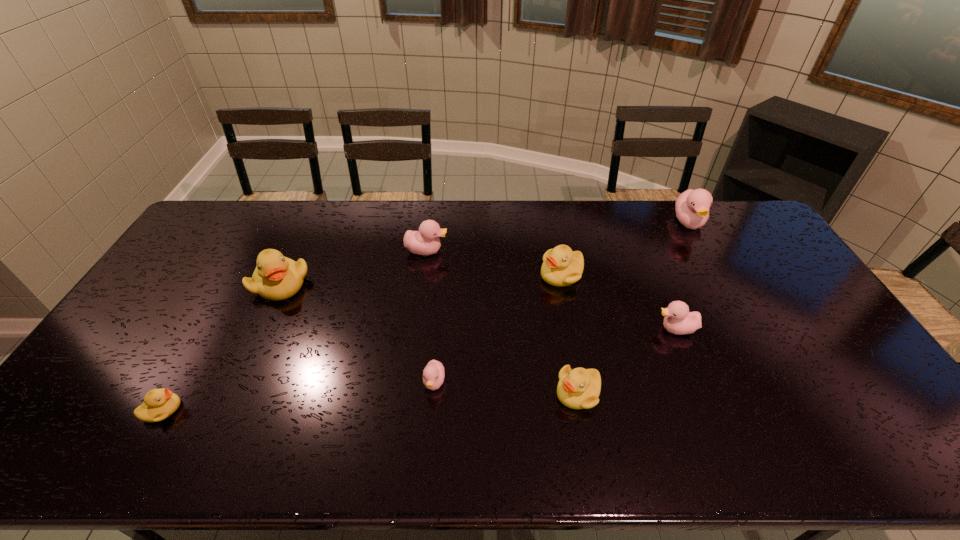
Identify which yellow duckling is the fourth closest to the second duckling from right to left. Please provide its 2D coordinates. Your answer should be formatted as a tuple, i.e. [(x, y)], where the tuple contains the x and y coordinates of a point satisfying the conditions above.

[(159, 404)]

Identify the location of free space that satisfies the following two spatial constraints: 1. on the front-facing side of the farthest object; 2. on the front-facing side of the smallest yellow duckling. The height and width of the screenshot is (540, 960). (794, 410).

Find the location of a particular element. This screenshot has height=540, width=960. vacant space that satisfies the following two spatial constraints: 1. on the front-facing side of the second biggest yellow duckling; 2. on the front-facing side of the seventh duckling from right to left is located at coordinates (564, 284).

The width and height of the screenshot is (960, 540). What are the coordinates of `blank space that satisfies the following two spatial constraints: 1. on the front-facing side of the seventh duckling from right to left; 2. on the front-facing side of the leftmost yellow duckling` in the screenshot? It's located at (223, 410).

This screenshot has height=540, width=960. Identify the location of vacant space that satisfies the following two spatial constraints: 1. on the front-facing side of the farthest object; 2. on the front-facing side of the second biggest yellow duckling. (718, 274).

Identify the location of free point that satisfies the following two spatial constraints: 1. on the front-facing side of the rightmost pink duckling; 2. on the front-facing side of the leftmost object. (794, 410).